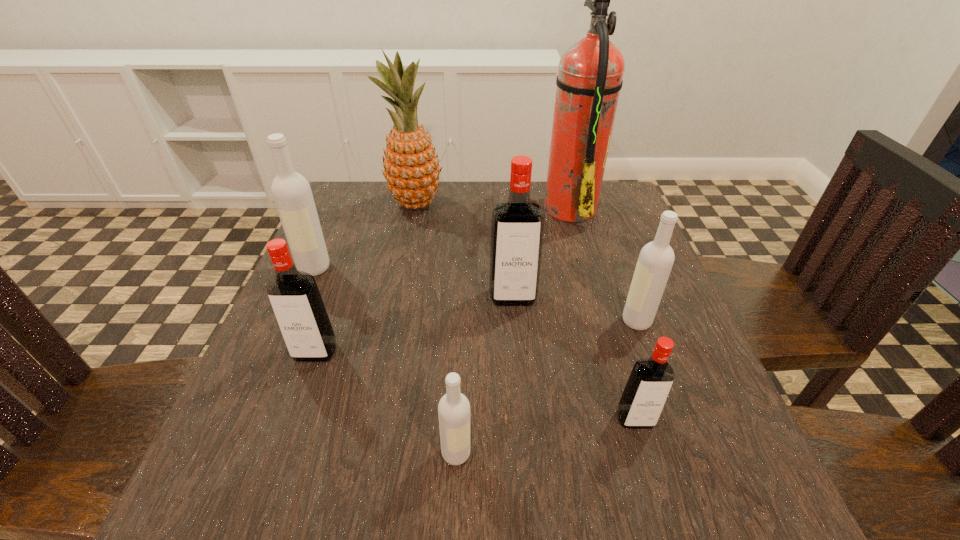
Where is `empty location between the sixth farthest object and the fourth vodka from left to right`? empty location between the sixth farthest object and the fourth vodka from left to right is located at coordinates (414, 325).

At what (x,y) coordinates should I click in order to perform the action: click on unoccupied position between the fire extinguisher and the second tallest object. Please return your answer as a coordinate pair (x, y). This screenshot has height=540, width=960. Looking at the image, I should click on (492, 205).

You are a GUI agent. You are given a task and a screenshot of the screen. Output one action in this format:
    pyautogui.click(x=<x>, y=<y>)
    Task: Click on the free space between the fire extinguisher and the sixth object from right to left
    
    Given the screenshot: What is the action you would take?
    pyautogui.click(x=492, y=205)

In order to click on empty space between the sixth farthest object and the biggest red vodka in this screenshot , I will do `click(414, 325)`.

The height and width of the screenshot is (540, 960). Identify the location of vacant area that lies between the fifth nearest object and the fifth farthest vodka. pyautogui.click(x=574, y=358).

Image resolution: width=960 pixels, height=540 pixels. Identify the location of vacant space in between the second tallest object and the third vodka from left to right. (436, 328).

Image resolution: width=960 pixels, height=540 pixels. What are the coordinates of `object that is the seventh closest to the smallest red vodka` in the screenshot? It's located at (291, 191).

Where is `object that is the second nearest to the smallest red vodka`? The height and width of the screenshot is (540, 960). object that is the second nearest to the smallest red vodka is located at coordinates (454, 408).

Where is `vodka that is the second closest to the second farthest red vodka`? The height and width of the screenshot is (540, 960). vodka that is the second closest to the second farthest red vodka is located at coordinates (454, 408).

Identify which vodka is located as the nearest to the nearest object. Please provide its 2D coordinates. Your answer should be formatted as a tuple, i.e. [(x, y)], where the tuple contains the x and y coordinates of a point satisfying the conditions above.

[(649, 384)]